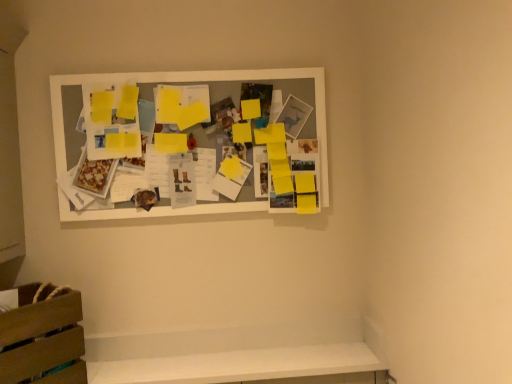
Question: In terms of size, does wooden crate at lower left appear bigger or smaller than white matte picture frame at upper center?

Choices:
 (A) big
 (B) small

Answer: (B)

Question: Considering their positions, is wooden crate at lower left located in front of or behind white matte picture frame at upper center?

Choices:
 (A) behind
 (B) front

Answer: (B)

Question: Visually, is wooden crate at lower left positioned to the left or to the right of white matte picture frame at upper center?

Choices:
 (A) right
 (B) left

Answer: (B)

Question: In terms of height, does white matte picture frame at upper center look taller or shorter compared to wooden crate at lower left?

Choices:
 (A) short
 (B) tall

Answer: (B)

Question: From the image's perspective, relative to wooden crate at lower left, is white matte picture frame at upper center above or below?

Choices:
 (A) above
 (B) below

Answer: (A)

Question: Is white matte picture frame at upper center inside the boundaries of wooden crate at lower left, or outside?

Choices:
 (A) inside
 (B) outside

Answer: (B)

Question: Relative to wooden crate at lower left, is white matte picture frame at upper center in front or behind?

Choices:
 (A) behind
 (B) front

Answer: (A)